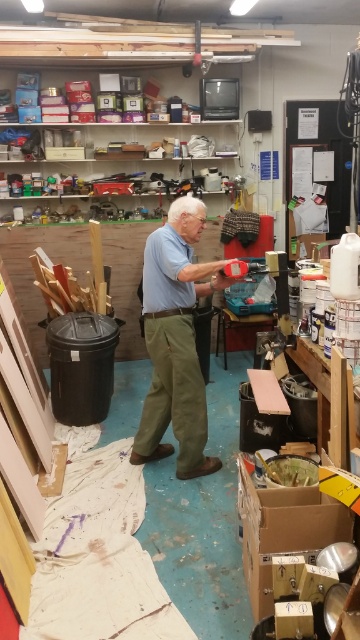
Between light blue cotton shirt at center and cardboard box at center, which one has more height?

light blue cotton shirt at center

Which is in front, point (203, 380) or point (275, 540)?

Positioned in front is point (275, 540).

The height and width of the screenshot is (640, 360). What are the coordinates of `light blue cotton shirt at center` in the screenshot? It's located at (176, 340).